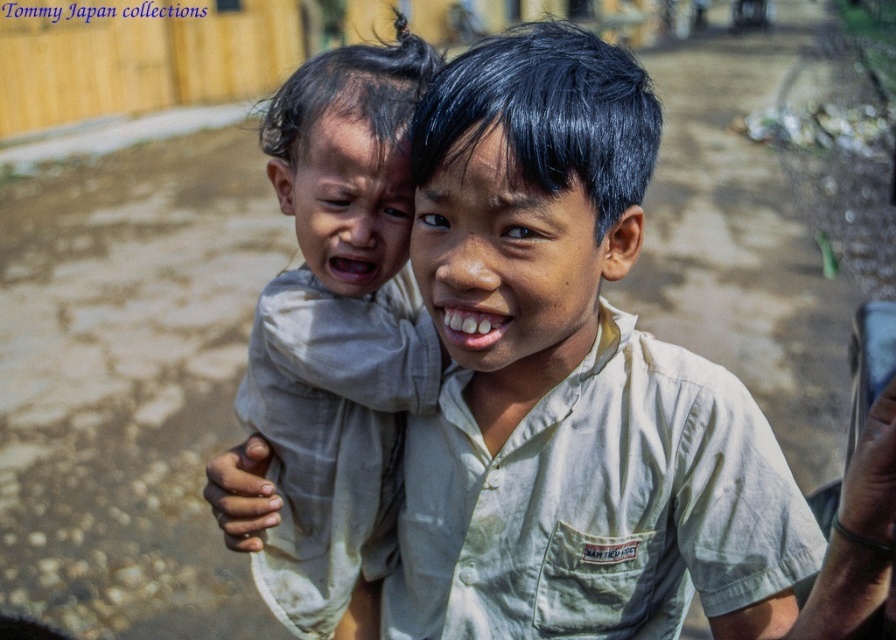
Consider the image. You are a photographer trying to capture a candid shot of the two children. You need to adjust your camera focus so that both the light beige shirt at center and the light beige fabric baby at left are in focus. Given their heights, which object should you focus on first to ensure both are sharp?

The light beige shirt at center is shorter than the light beige fabric baby at left. To ensure both are in focus, you should focus on the taller object first, which is the light beige fabric baby at left, as focusing on the taller object helps in achieving depth of field that can cover both subjects.

You are a photographer trying to capture both the light beige shirt at center and the light beige fabric baby at left in a single frame. Given that your camera has a limited focus range, which object should you prioritize focusing on to ensure it appears clearer in the photo?

The light beige shirt at center should be prioritized for focus because it is smaller in size compared to the light beige fabric baby at left, making it harder to capture details clearly without precise focus.

You are a photographer standing in front of the two children. You want to take a photo of the light beige shirt at center and the light beige fabric baby at left. The minimum distance your camera can focus is 6 inches. Can you take a clear photo of both objects at the same time?

The light beige shirt at center is 7.48 inches from the light beige fabric baby at left, so yes, the camera can focus on both objects since the distance between them is greater than the minimum focus distance of 6 inches.